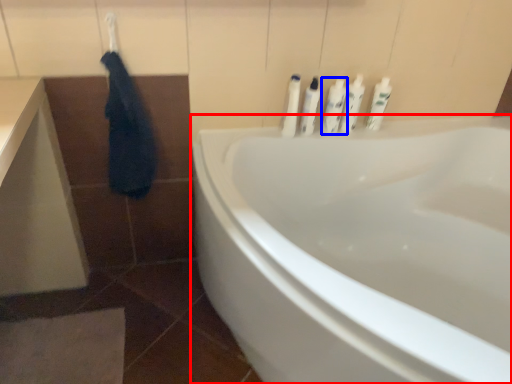
Question: Which object is closer to the camera taking this photo, bathtub (highlighted by a red box) or toiletry (highlighted by a blue box)?

Choices:
 (A) bathtub
 (B) toiletry

Answer: (A)